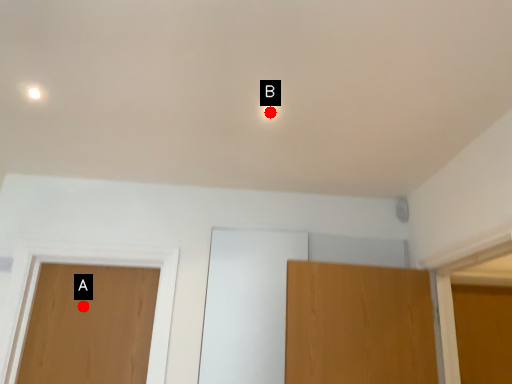
Question: Two points are circled on the image, labeled by A and B beside each circle. Which of the following is the farthest from the observer?

Choices:
 (A) A is further
 (B) B is further

Answer: (A)